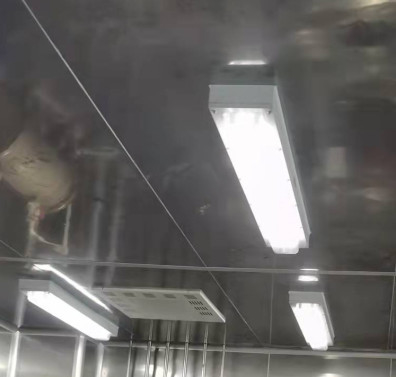
The width and height of the screenshot is (396, 377). In order to click on 3 ceiling lights in this screenshot , I will do `click(86, 331)`, `click(303, 308)`, `click(284, 232)`.